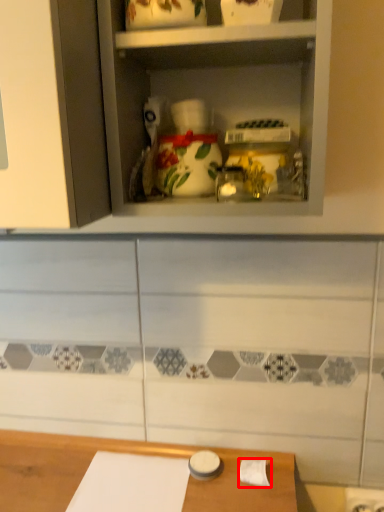
Question: From the image's perspective, where is toilet paper (annotated by the red box) located in relation to shelf in the image?

Choices:
 (A) above
 (B) below

Answer: (B)